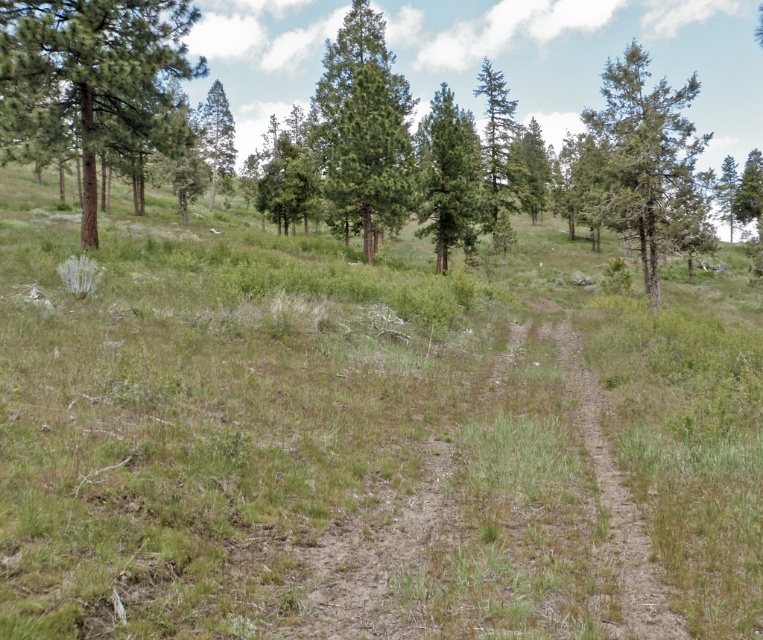
You are standing at the point marked as point (x=494, y=520). What is the terrain like around you?

The terrain around point (x=494, y=520) is a brown dirt track at center.

You are standing at the origin point of the image. Which direction should you walk to reach the brown dirt track at center?

The brown dirt track at center is located at point 0.814 on the x axis and 0.650 on the y axis, so you should walk towards the right and upwards to reach it.